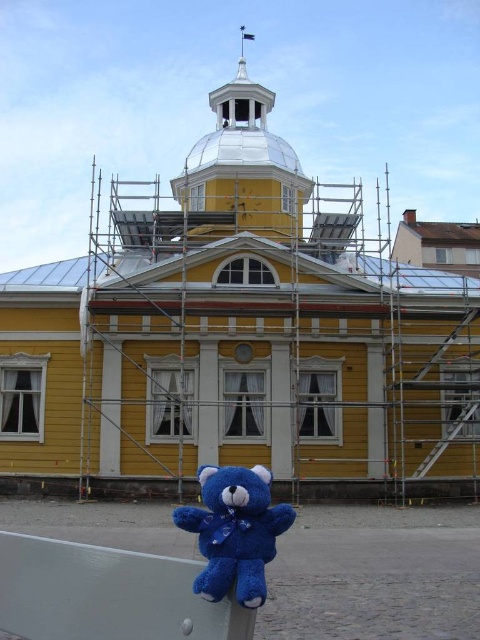
You are standing in front of the yellow wooden church at center and the blue plush bear at lower center. Which object is closer to the left side of the frame?

The blue plush bear at lower center is closer to the left side of the frame because the yellow wooden church at center is positioned to its right.

You are standing in front of the yellow wooden church at center and want to place a decoration on the blue plush bear at lower center. Which direction should you move to reach the bear?

The yellow wooden church at center is located above the blue plush bear at lower center, so you should move downward to reach the bear.